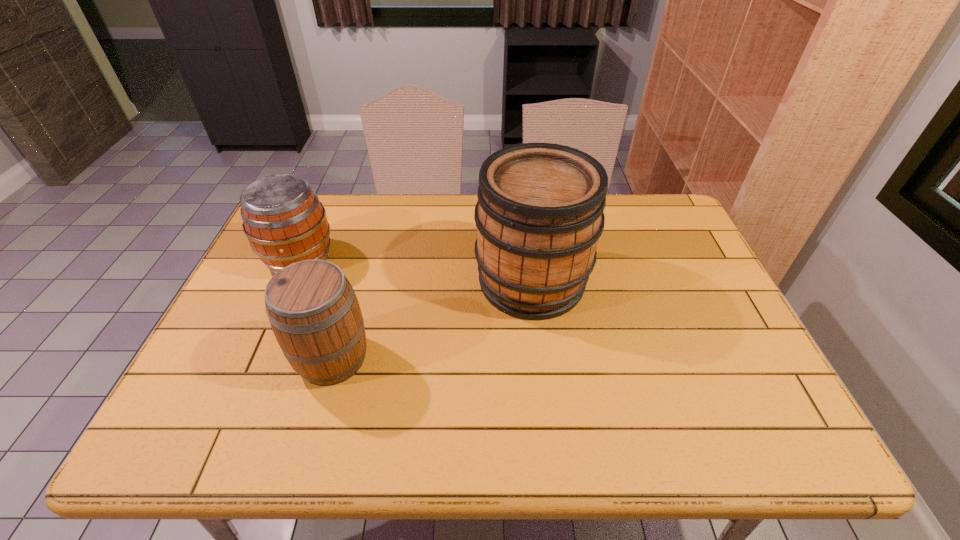
At what (x,y) coordinates should I click in order to perform the action: click on vacant space at the left edge of the desktop. Please return your answer as a coordinate pair (x, y). Image resolution: width=960 pixels, height=540 pixels. Looking at the image, I should click on (255, 282).

I want to click on free space at the right edge of the desktop, so click(694, 252).

At what (x,y) coordinates should I click in order to perform the action: click on free spot between the tallest cider and the nearest cider. Please return your answer as a coordinate pair (x, y). This screenshot has height=540, width=960. Looking at the image, I should click on (432, 320).

Find the location of a particular element. The width and height of the screenshot is (960, 540). free point between the rightmost cider and the nearest cider is located at coordinates (432, 320).

Identify the location of vacant area between the nearest object and the rightmost cider. (432, 320).

At what (x,y) coordinates should I click in order to perform the action: click on free space between the nearest cider and the rightmost cider. Please return your answer as a coordinate pair (x, y). Looking at the image, I should click on (432, 320).

Locate which object ranks in proximity to the rightmost object. Please provide its 2D coordinates. Your answer should be formatted as a tuple, i.e. [(x, y)], where the tuple contains the x and y coordinates of a point satisfying the conditions above.

[(312, 308)]

This screenshot has height=540, width=960. Identify the location of the second closest object to the tallest object. (283, 219).

Where is `the second closest cider to the nearest cider`? This screenshot has height=540, width=960. the second closest cider to the nearest cider is located at coordinates (539, 215).

Identify which cider is located as the second nearest to the nearest cider. Please provide its 2D coordinates. Your answer should be formatted as a tuple, i.e. [(x, y)], where the tuple contains the x and y coordinates of a point satisfying the conditions above.

[(539, 215)]